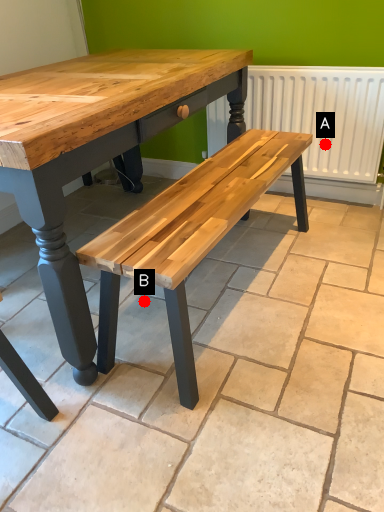
Question: Two points are circled on the image, labeled by A and B beside each circle. Which point is farther from the camera taking this photo?

Choices:
 (A) A is further
 (B) B is further

Answer: (A)